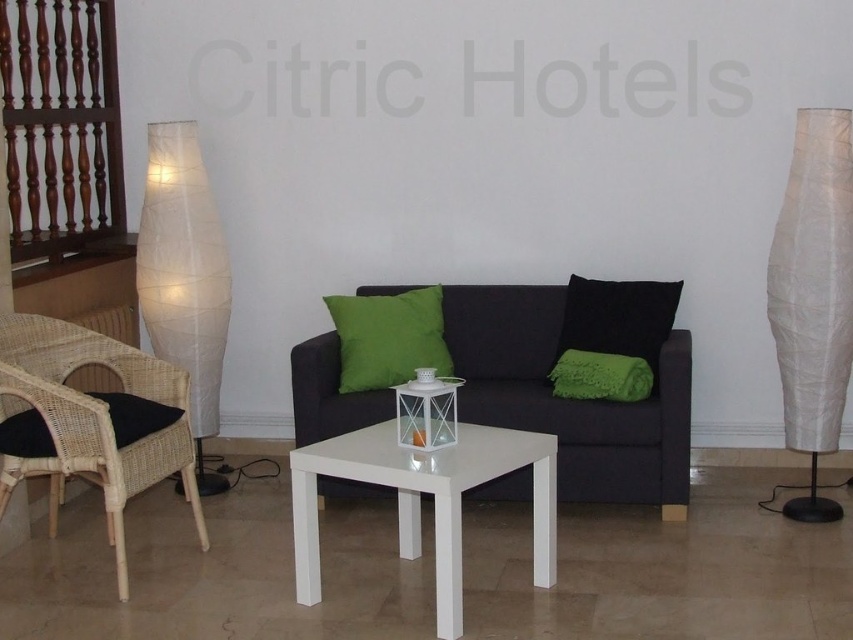
You are a guest in the Citric Hotels lobby and want to place a small vase between the white paper lamp at right and the black matte pillow at center. Based on their positions, will the vase fit snugly between them without overlapping either object?

The white paper lamp at right is in front of the black matte pillow at center, so placing the vase between them would require considering their spatial arrangement. Since the lamp is positioned in front, there might be enough space between them to place the vase without overlapping, but the exact distance isn not specified. However, based on typical interior spacing, it should fit snugly.